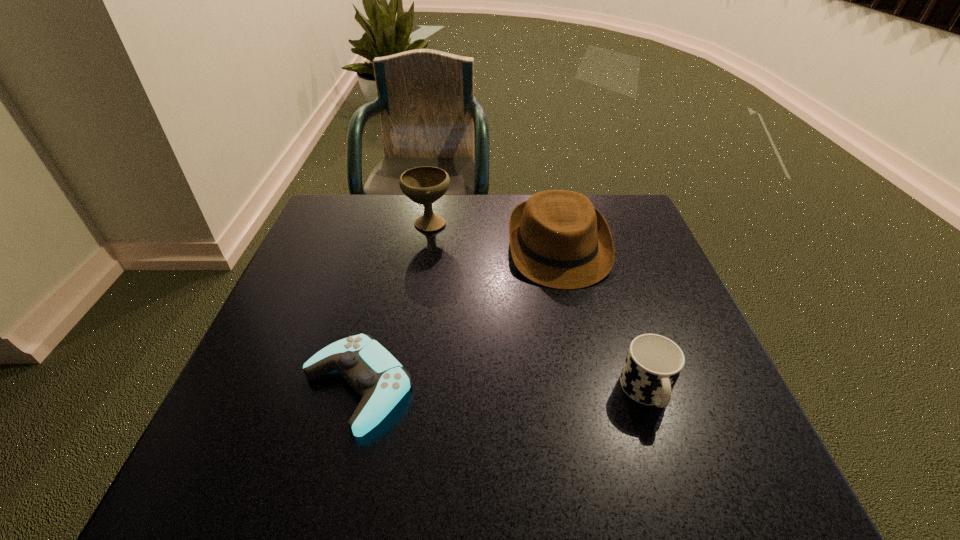
You are a GUI agent. You are given a task and a screenshot of the screen. Output one action in this format:
    pyautogui.click(x=<x>, y=<y>)
    Task: Click on the tallest object
    This screenshot has height=540, width=960.
    Given the screenshot: What is the action you would take?
    pyautogui.click(x=424, y=185)

Locate an element on the screen. the second tallest object is located at coordinates (558, 239).

At what (x,y) coordinates should I click in order to perform the action: click on cup. Please return your answer as a coordinate pair (x, y). Looking at the image, I should click on (653, 364).

You are a GUI agent. You are given a task and a screenshot of the screen. Output one action in this format:
    pyautogui.click(x=<x>, y=<y>)
    Task: Click on the shortest object
    The height and width of the screenshot is (540, 960).
    Given the screenshot: What is the action you would take?
    pyautogui.click(x=373, y=372)

The image size is (960, 540). I want to click on vacant space located 0.250m on the right of the chalice, so click(541, 222).

This screenshot has width=960, height=540. In order to click on free space located 0.250m on the front-facing side of the fedora in this screenshot , I will do `click(587, 380)`.

Locate an element on the screen. free space located 0.110m on the side of the third tallest object with the handle is located at coordinates (679, 487).

Image resolution: width=960 pixels, height=540 pixels. Identify the location of free space located 0.080m on the right of the control. (455, 387).

Locate an element on the screen. This screenshot has height=540, width=960. chalice located in the far edge section of the desktop is located at coordinates (424, 185).

You are a GUI agent. You are given a task and a screenshot of the screen. Output one action in this format:
    pyautogui.click(x=<x>, y=<y>)
    Task: Click on the fedora that is positioned at the far edge
    The image size is (960, 540).
    Given the screenshot: What is the action you would take?
    pyautogui.click(x=558, y=239)